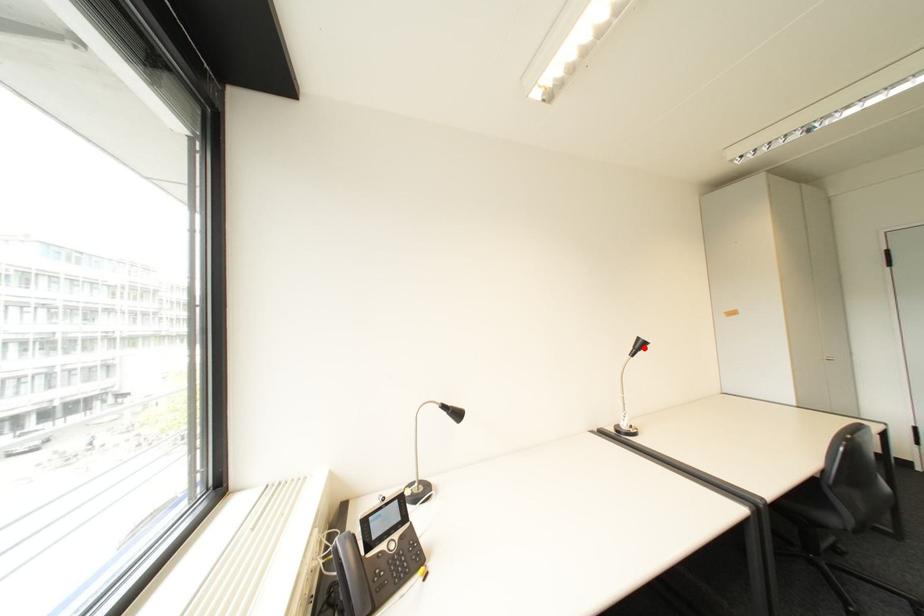
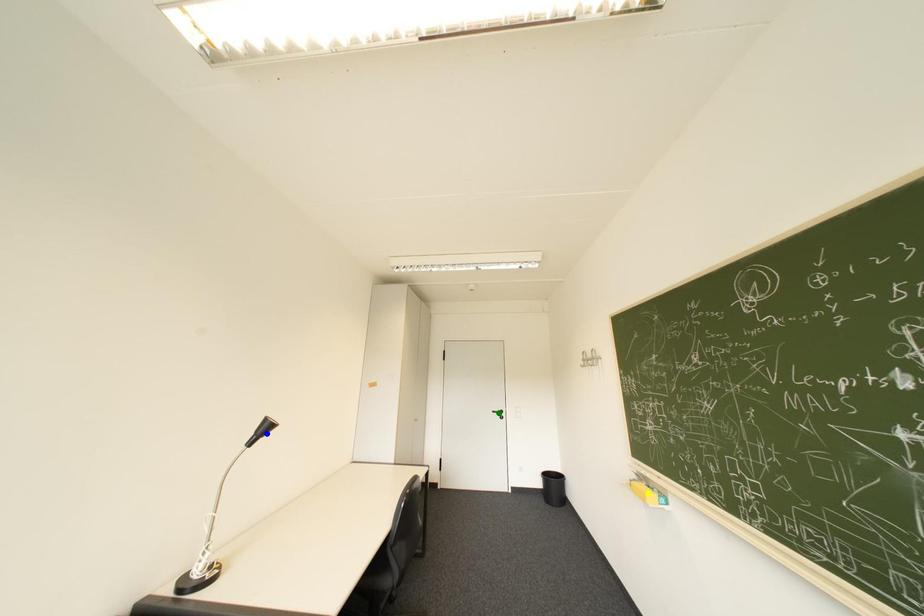
Question: I am providing you with two images of the same scene from different viewpoints. A red point is marked on the first image. You are given multiple points on the second image. In image 2, which mark is for the same physical point as the one in image 1?

Choices:
 (A) green point
 (B) yellow point
 (C) blue point

Answer: (C)